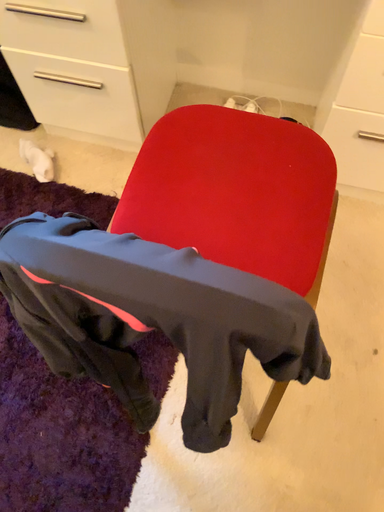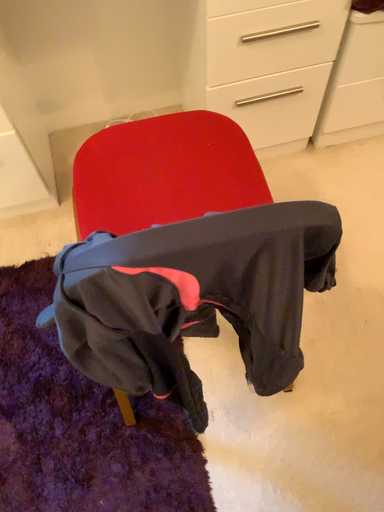
Question: How did the camera likely rotate when shooting the video?

Choices:
 (A) rotated upward
 (B) rotated downward

Answer: (A)